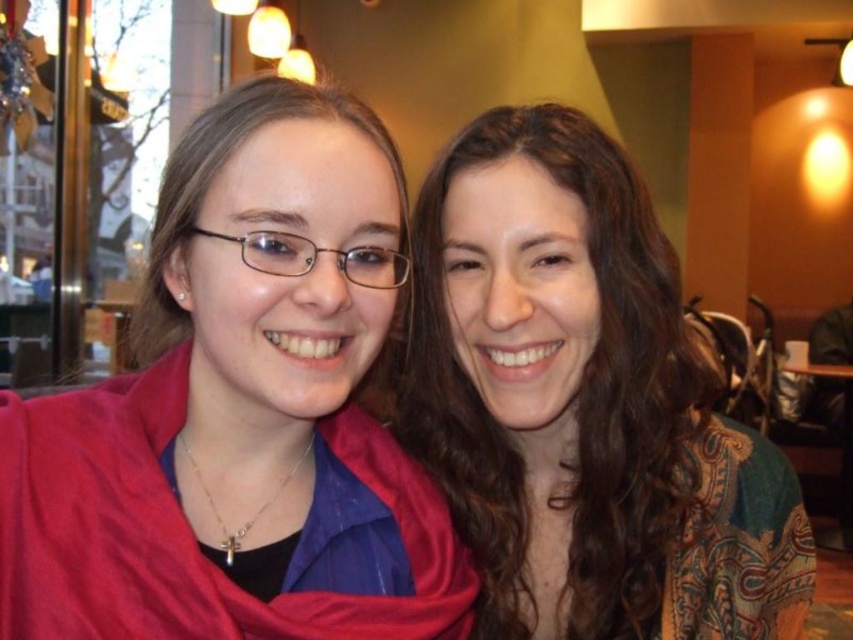
You are a photographer adjusting your camera to focus on the point at coordinates (241, 412). Which object from the scene will be in focus at this point?

The matte red scarf at left is located at point (241, 412), so focusing there will put the matte red scarf at left in focus.

You are designing a gift box that needs to accommodate both the matte red scarf at left and the matte brown hair at center. Given their widths, which object requires more horizontal space in the box?

The matte brown hair at center requires more horizontal space in the box because it has a greater width than the matte red scarf at left.

You are a photographer trying to capture a clear shot of both the matte red scarf at left and the matte brown hair at center. Based on their positions, can you adjust your camera angle to ensure both are fully visible without any obstruction?

The matte red scarf at left is in front of the matte brown hair at center, so adjusting the camera angle slightly backward or to the side could allow both to be visible without obstruction.